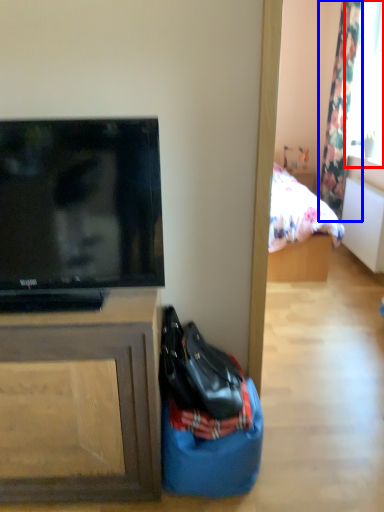
Question: Which of the following is the closest to the observer, window screen (highlighted by a red box) or curtain (highlighted by a blue box)?

Choices:
 (A) window screen
 (B) curtain

Answer: (A)